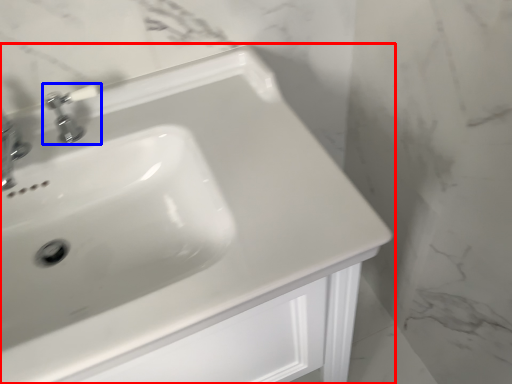
Question: Which object is further to the camera taking this photo, sink (highlighted by a red box) or tap (highlighted by a blue box)?

Choices:
 (A) sink
 (B) tap

Answer: (B)